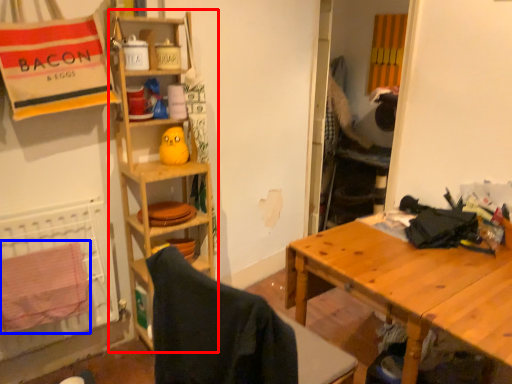
Question: Among these objects, which one is farthest to the camera, shelf (highlighted by a red box) or beach towel (highlighted by a blue box)?

Choices:
 (A) shelf
 (B) beach towel

Answer: (A)